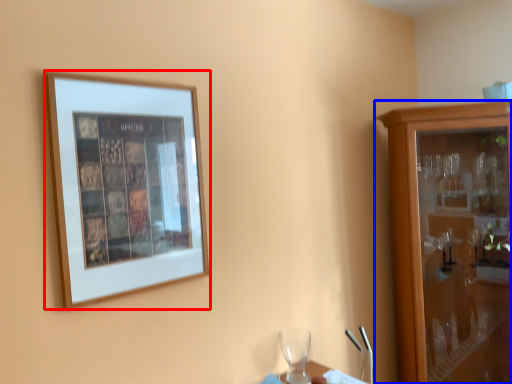
Question: Which object is further to the camera taking this photo, picture frame (highlighted by a red box) or cabinetry (highlighted by a blue box)?

Choices:
 (A) picture frame
 (B) cabinetry

Answer: (B)